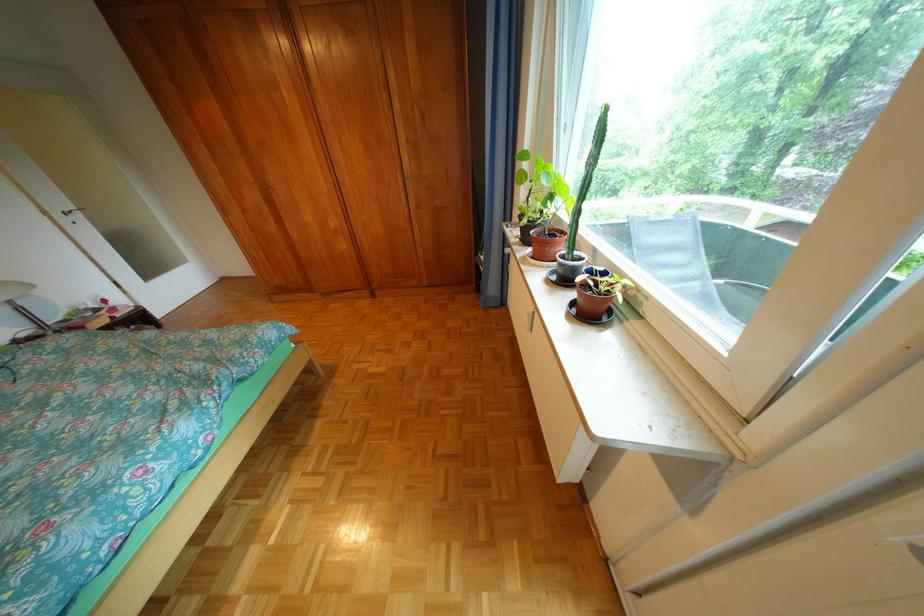
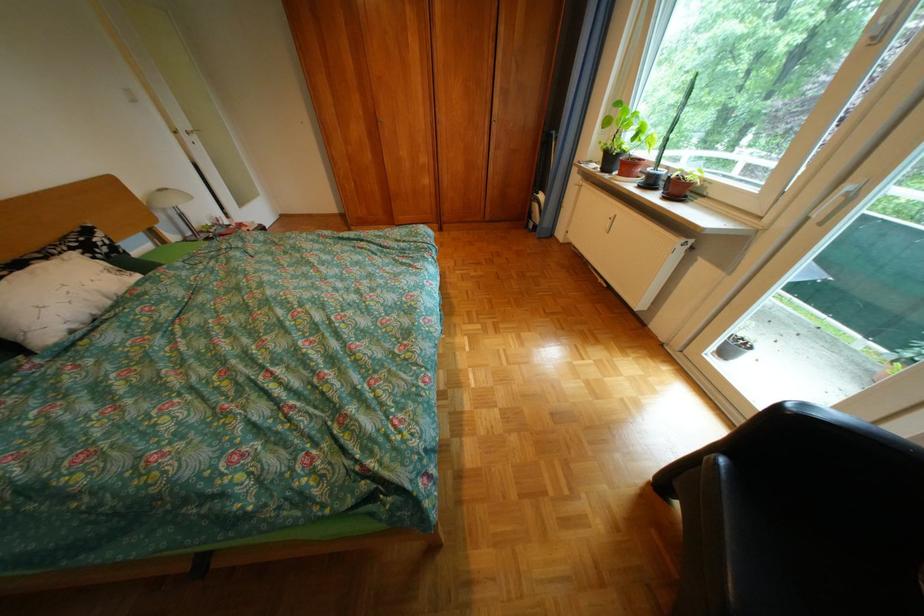
The images are taken continuously from a first-person perspective. In which direction are you moving?

The cameraman moved toward left, backward.